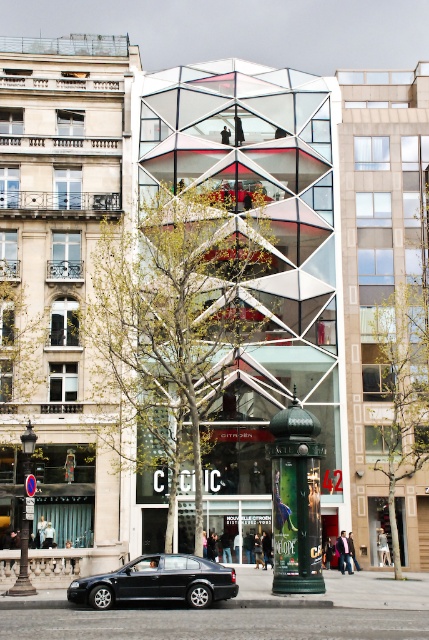
You are standing in front of the modern glass building and want to walk to the shiny black sedan at lower left. Is the green leafy tree at right blocking your direct path?

The green leafy tree at right is further to the viewer than the shiny black sedan at lower left, so the tree is not blocking the path to the sedan.

You are standing in front of the modern building and want to walk towards the traditional beige stone building. Which direction should you walk relative to the green leafy tree at center and the green leafy tree at right?

You should walk to the right of the green leafy tree at center and to the left of the green leafy tree at right because the traditional beige stone building is located in front of the modern building, and the trees are positioned such that the green leafy tree at center is to the left of the green leafy tree at right. By moving towards the right side of the central tree and the left side of the right tree, you would be heading towards the traditional building.

You are a city planner who needs to install a new bench between the green leafy tree at center and the green metallic pillar at center. The bench requires a minimum of 10 meters of space to be placed comfortably. Based on the scene, can the bench be placed between them?

The green leafy tree at center is 9.76 meters from the green metallic pillar at center. Since the required space is 10 meters and the distance is less than that, the bench cannot be placed comfortably between them.